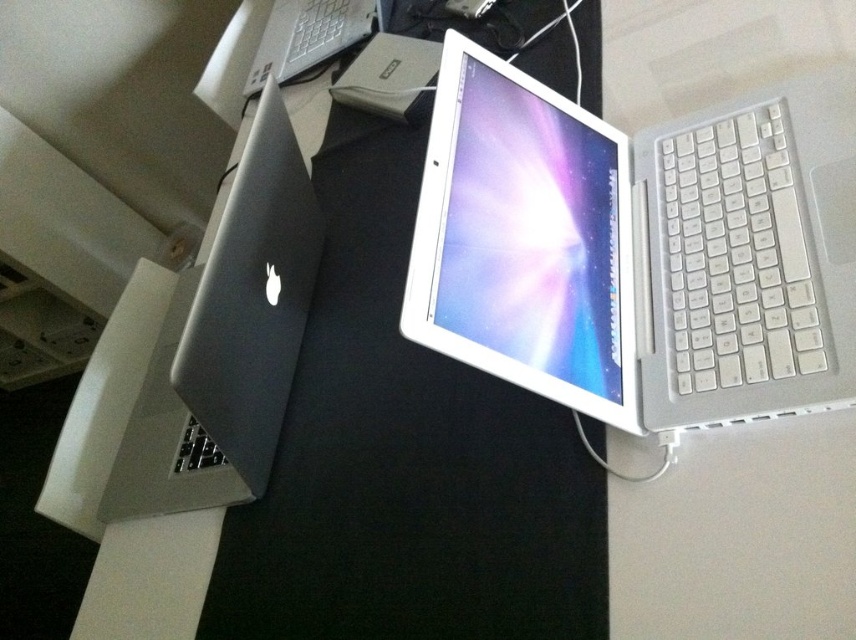
You are a delivery person who needs to place a rectangular box that is 20 inches long on the desk between the satin silver laptop at left and the white plastic keyboard at right. Will the box fit horizontally between them without overlapping either object?

The satin silver laptop at left is 19.68 inches away from the white plastic keyboard at right. Since the box is 20 inches long, it is slightly longer than the available space between them. Therefore, the box will not fit horizontally between the satin silver laptop at left and the white plastic keyboard at right without overlapping either object.

Based on the photo, you are trying to place a small plant between the satin silver laptop at left and another object on the desk. Which object is the laptop positioned to the left of?

The satin silver laptop at left is located at point (226, 340). Since there is only one other object mentioned, the white Apple laptop on the right, the laptop is positioned to the left of the white Apple laptop on the right.

You are organizing a tech showcase and need to arrange the satin silver laptop at left and the white plastic keyboard at right. According to the image, which object should be placed on the left side of the display?

The satin silver laptop at left should be placed on the left side of the display since it is already positioned to the left of the white plastic keyboard at right in the image.